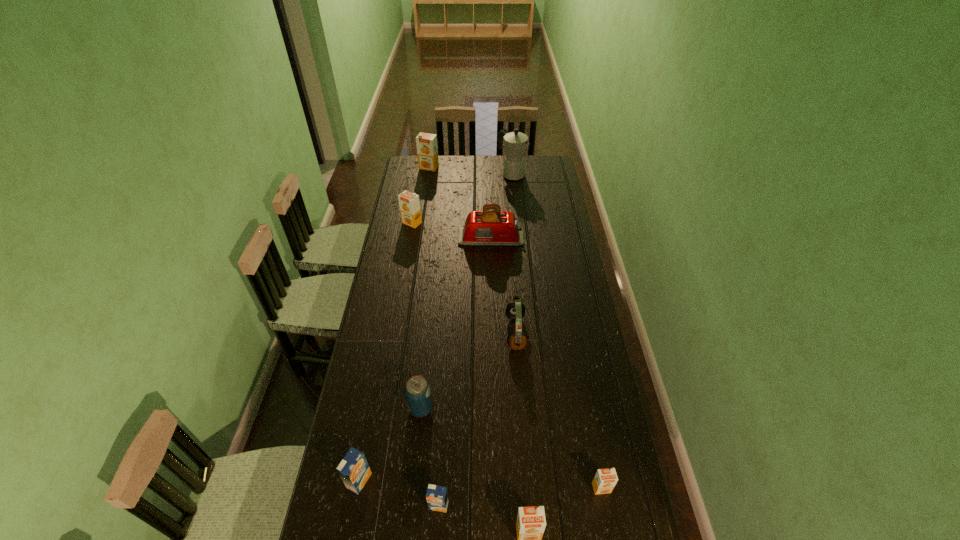
This screenshot has width=960, height=540. In order to click on the bigger blue orange_juice in this screenshot , I will do `click(354, 470)`.

Locate an element on the screen. the farther blue orange_juice is located at coordinates (354, 470).

Where is `the second nearest orange orange juice`? Image resolution: width=960 pixels, height=540 pixels. the second nearest orange orange juice is located at coordinates (605, 480).

Locate an element on the screen. The width and height of the screenshot is (960, 540). the smallest orange orange juice is located at coordinates (605, 480).

The image size is (960, 540). What are the coordinates of `the second nearest object` in the screenshot? It's located at (437, 497).

Where is `the fifth farthest orange_juice`? This screenshot has width=960, height=540. the fifth farthest orange_juice is located at coordinates (437, 497).

Find the location of a particular element. The width and height of the screenshot is (960, 540). free space located on the back of the gray coffeepot is located at coordinates (510, 157).

Find the location of a particular element. This screenshot has width=960, height=540. vacant area located on the front of the farthest orange_juice is located at coordinates (427, 179).

Identify the location of vacant space situated 0.110m on the right of the red toaster. The width and height of the screenshot is (960, 540). (545, 238).

This screenshot has width=960, height=540. I want to click on vacant space located 0.170m on the right of the third farthest object, so click(455, 223).